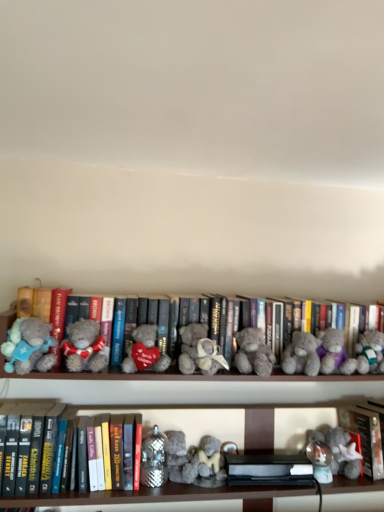
In order to face gray plush bear at center, which ranks as the second book in right-to-left order, should I rotate leftwards or rightwards?

To face it directly, rotate right by 3.977 degrees.

This screenshot has height=512, width=384. What are the coordinates of `fluffy gray teddy bear at left, placed as the 6th teddy bear when sorted from right to left` in the screenshot? It's located at pyautogui.click(x=84, y=346).

You are a GUI agent. You are given a task and a screenshot of the screen. Output one action in this format:
    pyautogui.click(x=<x>, y=<y>)
    Task: Click on the fluffy gray teddy bear at center, which appears as the 4th teddy bear when viewed from the left
    This screenshot has width=384, height=512.
    Given the screenshot: What is the action you would take?
    pyautogui.click(x=199, y=351)

This screenshot has width=384, height=512. Describe the element at coordinates (199, 351) in the screenshot. I see `fluffy gray teddy bear at center, placed as the fourth teddy bear when sorted from right to left` at that location.

Describe the element at coordinates (35, 449) in the screenshot. I see `hardcover book at lower left, the third book in the right-to-left sequence` at that location.

You are a GUI agent. You are given a task and a screenshot of the screen. Output one action in this format:
    pyautogui.click(x=<x>, y=<y>)
    Task: Click on the gray plush bear at center, which ranks as the second book in right-to-left order
    
    Given the screenshot: What is the action you would take?
    [x=332, y=360]

Can you confirm if fuzzy gray teddy bear at lower right, acting as the second toy starting from the top, is taller than hardcover book at lower left, the third book in the right-to-left sequence?

In fact, fuzzy gray teddy bear at lower right, acting as the second toy starting from the top, may be shorter than hardcover book at lower left, the third book in the right-to-left sequence.

From the image's perspective, which object appears higher, fuzzy gray teddy bear at lower right, acting as the 1th toy starting from the left, or hardcover book at lower left, acting as the 1th book starting from the left?

hardcover book at lower left, acting as the 1th book starting from the left, from the image's perspective.

Looking at this image, considering the positions of objects fuzzy gray teddy bear at lower right, acting as the second toy starting from the top, and hardcover book at lower left, acting as the 1th book starting from the left, in the image provided, who is more to the right, fuzzy gray teddy bear at lower right, acting as the second toy starting from the top, or hardcover book at lower left, acting as the 1th book starting from the left,?

fuzzy gray teddy bear at lower right, acting as the second toy starting from the top.

Is fuzzy gray teddy bear at lower right, acting as the second toy starting from the top, bigger than hardcover book at lower left, the third book in the right-to-left sequence?

Incorrect, fuzzy gray teddy bear at lower right, acting as the second toy starting from the top, is not larger than hardcover book at lower left, the third book in the right-to-left sequence.

Is point (339, 438) closer or farther from the camera than point (373, 431)?

Point (339, 438) is farther from the camera than point (373, 431).

Does fuzzy gray teddy bear at lower right, arranged as the 2th toy when viewed from the right, have a smaller size compared to red matte book at lower right, the 3th book from the left?

Yes.

From the image's perspective, would you say fuzzy gray teddy bear at lower right, acting as the second toy starting from the top, is positioned over red matte book at lower right, positioned as the 1th book in right-to-left order?

No, from the image's perspective, fuzzy gray teddy bear at lower right, acting as the second toy starting from the top, is not on top of red matte book at lower right, positioned as the 1th book in right-to-left order.

From a real-world perspective, count 4th teddy bears upward from the fluffy gray teddy bear at center, the second teddy bear when ordered from right to left, and point to it. Please provide its 2D coordinates.

[(26, 344)]

Is fluffy gray teddy bear at center, the second teddy bear when ordered from right to left, looking in the opposite direction of fluffy gray teddy bear at left, arranged as the first teddy bear when viewed from the left?

fluffy gray teddy bear at center, the second teddy bear when ordered from right to left, does not have its back to fluffy gray teddy bear at left, arranged as the first teddy bear when viewed from the left.

Considering the sizes of objects fluffy gray teddy bear at center, the sixth teddy bear when ordered from left to right, and fluffy gray teddy bear at left, acting as the seventh teddy bear starting from the right, in the image provided, who is shorter, fluffy gray teddy bear at center, the sixth teddy bear when ordered from left to right, or fluffy gray teddy bear at left, acting as the seventh teddy bear starting from the right,?

Standing shorter between the two is fluffy gray teddy bear at center, the sixth teddy bear when ordered from left to right.

Find the location of a particular element. Image resolution: width=384 pixels, height=512 pixels. the 1st teddy bear positioned below the fluffy gray teddy bear at left, acting as the seventh teddy bear starting from the right (from a real-world perspective) is located at coordinates (145, 351).

Is fluffy gray teddy bear at left, acting as the seventh teddy bear starting from the right, bigger than fluffy gray teddy bear with heart at center, acting as the fifth teddy bear starting from the right?

→ Correct, fluffy gray teddy bear at left, acting as the seventh teddy bear starting from the right, is larger in size than fluffy gray teddy bear with heart at center, acting as the fifth teddy bear starting from the right.

From a real-world perspective, which object stands above the other?

From a 3D spatial view, fluffy gray teddy bear at left, acting as the seventh teddy bear starting from the right, is above.

This screenshot has width=384, height=512. Find the location of `the 2nd teddy bear in front when counting from the red matte book at lower right, positioned as the 1th book in right-to-left order`. the 2nd teddy bear in front when counting from the red matte book at lower right, positioned as the 1th book in right-to-left order is located at coordinates (301, 355).

Is red matte book at lower right, the 3th book from the left, surrounded by fluffy gray teddy bear at center, the sixth teddy bear when ordered from left to right?

Definitely not — red matte book at lower right, the 3th book from the left, is not inside fluffy gray teddy bear at center, the sixth teddy bear when ordered from left to right.

Which object is further away from the camera, fluffy gray teddy bear at center, the second teddy bear when ordered from right to left, or red matte book at lower right, positioned as the 1th book in right-to-left order?

red matte book at lower right, positioned as the 1th book in right-to-left order, is more distant.

From the image's perspective, which object appears higher, gray plush toy at right, arranged as the 2th toy when viewed from the left, or fluffy gray teddy bear at left, the second teddy bear viewed from the left?

From the image's view, fluffy gray teddy bear at left, the second teddy bear viewed from the left, is above.

Is gray plush toy at right, positioned as the first toy in top-to-bottom order, facing towards fluffy gray teddy bear at left, placed as the 6th teddy bear when sorted from right to left?

No, gray plush toy at right, positioned as the first toy in top-to-bottom order, is not aimed at fluffy gray teddy bear at left, placed as the 6th teddy bear when sorted from right to left.

Between point (365, 339) and point (73, 324), which one is positioned in front?

The point (73, 324) is closer.

From a real-world perspective, is gray plush toy at right, arranged as the 2th toy when viewed from the left, below fluffy gray teddy bear at left, the second teddy bear viewed from the left?

Indeed, from a real-world perspective, gray plush toy at right, arranged as the 2th toy when viewed from the left, is positioned beneath fluffy gray teddy bear at left, the second teddy bear viewed from the left.

Is hardcover book at lower left, acting as the 1th book starting from the left, not close to gray plush toy at right, marked as the first toy in a right-to-left arrangement?

No, hardcover book at lower left, acting as the 1th book starting from the left, is not far from gray plush toy at right, marked as the first toy in a right-to-left arrangement.

Considering the relative positions of hardcover book at lower left, acting as the 1th book starting from the left, and gray plush toy at right, marked as the first toy in a right-to-left arrangement, in the image provided, is hardcover book at lower left, acting as the 1th book starting from the left, to the right of gray plush toy at right, marked as the first toy in a right-to-left arrangement, from the viewer's perspective?

No, hardcover book at lower left, acting as the 1th book starting from the left, is not to the right of gray plush toy at right, marked as the first toy in a right-to-left arrangement.

Can you tell me how much hardcover book at lower left, the third book in the right-to-left sequence, and gray plush toy at right, marked as the first toy in a right-to-left arrangement, differ in facing direction?

The angle between the facing direction of hardcover book at lower left, the third book in the right-to-left sequence, and the facing direction of gray plush toy at right, marked as the first toy in a right-to-left arrangement, is 2.49 degrees.

Considering the positions of objects hardcover book at lower left, the third book in the right-to-left sequence, and gray plush toy at right, which is the 2th toy in bottom-to-top order, in the image provided, who is behind, hardcover book at lower left, the third book in the right-to-left sequence, or gray plush toy at right, which is the 2th toy in bottom-to-top order,?

gray plush toy at right, which is the 2th toy in bottom-to-top order, is more distant.

Identify the location of toy below the hardcover book at lower left, acting as the 1th book starting from the left (from a real-world perspective). This screenshot has width=384, height=512. (344, 453).

You are a GUI agent. You are given a task and a screenshot of the screen. Output one action in this format:
    pyautogui.click(x=<x>, y=<y>)
    Task: Click on the 2nd book positioned above the fuzzy gray teddy bear at lower right, acting as the 1th toy starting from the left (from a real-world perspective)
    The width and height of the screenshot is (384, 512).
    Given the screenshot: What is the action you would take?
    pyautogui.click(x=365, y=437)

Looking at the image, which one is located further to fluffy gray teddy bear at left, placed as the 6th teddy bear when sorted from right to left, fluffy beige teddy bear at right, which is counted as the 1th teddy bear, starting from the right, or red matte book at lower right, positioned as the 1th book in right-to-left order?

red matte book at lower right, positioned as the 1th book in right-to-left order, is positioned further to the anchor fluffy gray teddy bear at left, placed as the 6th teddy bear when sorted from right to left.

Which object lies further to the anchor point fluffy gray teddy bear with heart at center, acting as the fifth teddy bear starting from the right, fuzzy gray teddy bear at lower right, acting as the 1th toy starting from the left, or fluffy gray teddy bear at center, the sixth teddy bear when ordered from left to right?

fuzzy gray teddy bear at lower right, acting as the 1th toy starting from the left, lies further to fluffy gray teddy bear with heart at center, acting as the fifth teddy bear starting from the right, than the other object.

Which object lies nearer to the anchor point red matte book at lower right, the 3th book from the left, fluffy gray teddy bear at center, placed as the fourth teddy bear when sorted from right to left, or hardcover book at lower left, the third book in the right-to-left sequence?

The object closer to red matte book at lower right, the 3th book from the left, is fluffy gray teddy bear at center, placed as the fourth teddy bear when sorted from right to left.

Based on their spatial positions, is fluffy gray teddy bear with heart at center, the third teddy bear in the left-to-right sequence, or fluffy gray teddy bear at left, the second teddy bear viewed from the left, closer to fluffy gray teddy bear at center, the second teddy bear when ordered from right to left?

fluffy gray teddy bear with heart at center, the third teddy bear in the left-to-right sequence, lies closer to fluffy gray teddy bear at center, the second teddy bear when ordered from right to left, than the other object.

From the picture: Which object lies nearer to the anchor point fluffy gray teddy bear at left, arranged as the first teddy bear when viewed from the left, fluffy gray teddy bear with heart at center, acting as the fifth teddy bear starting from the right, or fluffy gray teddy bear at center, placed as the fourth teddy bear when sorted from right to left?

fluffy gray teddy bear with heart at center, acting as the fifth teddy bear starting from the right, is closer to fluffy gray teddy bear at left, arranged as the first teddy bear when viewed from the left.

Based on their spatial positions, is fuzzy gray teddy bear at center, placed as the 3th teddy bear when sorted from right to left, or fluffy gray teddy bear with heart at center, acting as the fifth teddy bear starting from the right, closer to hardcover book at lower left, the third book in the right-to-left sequence?

fluffy gray teddy bear with heart at center, acting as the fifth teddy bear starting from the right.

Looking at the image, which one is located further to gray plush toy at right, arranged as the 2th toy when viewed from the left, gray plush bear at center, which appears as the second book when viewed from the left, or fluffy gray teddy bear at left, the second teddy bear viewed from the left?

fluffy gray teddy bear at left, the second teddy bear viewed from the left, is further to gray plush toy at right, arranged as the 2th toy when viewed from the left.

Considering their positions, is gray plush toy at right, positioned as the first toy in top-to-bottom order, positioned closer to hardcover book at lower left, the third book in the right-to-left sequence, than fluffy gray teddy bear at left, placed as the 6th teddy bear when sorted from right to left?

fluffy gray teddy bear at left, placed as the 6th teddy bear when sorted from right to left, lies closer to hardcover book at lower left, the third book in the right-to-left sequence, than the other object.

Where is `teddy bear between fluffy gray teddy bear at center, the sixth teddy bear when ordered from left to right, and red matte book at lower right, the 3th book from the left, vertically`? teddy bear between fluffy gray teddy bear at center, the sixth teddy bear when ordered from left to right, and red matte book at lower right, the 3th book from the left, vertically is located at coordinates (334, 353).

I want to click on book situated between hardcover book at lower left, the third book in the right-to-left sequence, and fluffy gray teddy bear at center, the sixth teddy bear when ordered from left to right, from left to right, so click(332, 360).

Locate an element on the screen. teddy bear located between fluffy gray teddy bear at center, the second teddy bear when ordered from right to left, and gray plush toy at right, positioned as the first toy in top-to-bottom order, in the left-right direction is located at coordinates (334, 353).

The image size is (384, 512). I want to click on book situated between fluffy gray teddy bear with heart at center, the third teddy bear in the left-to-right sequence, and red matte book at lower right, positioned as the 1th book in right-to-left order, from left to right, so click(x=332, y=360).